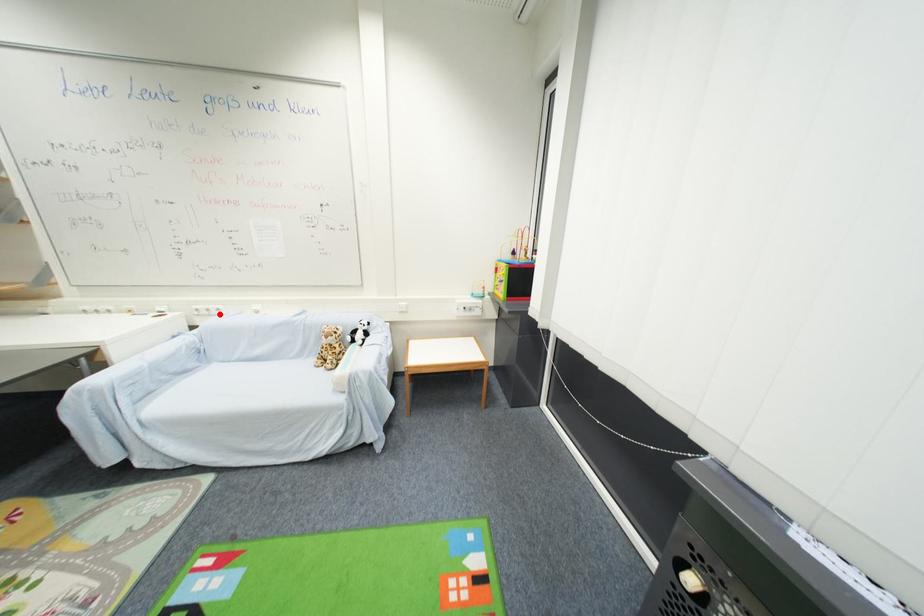
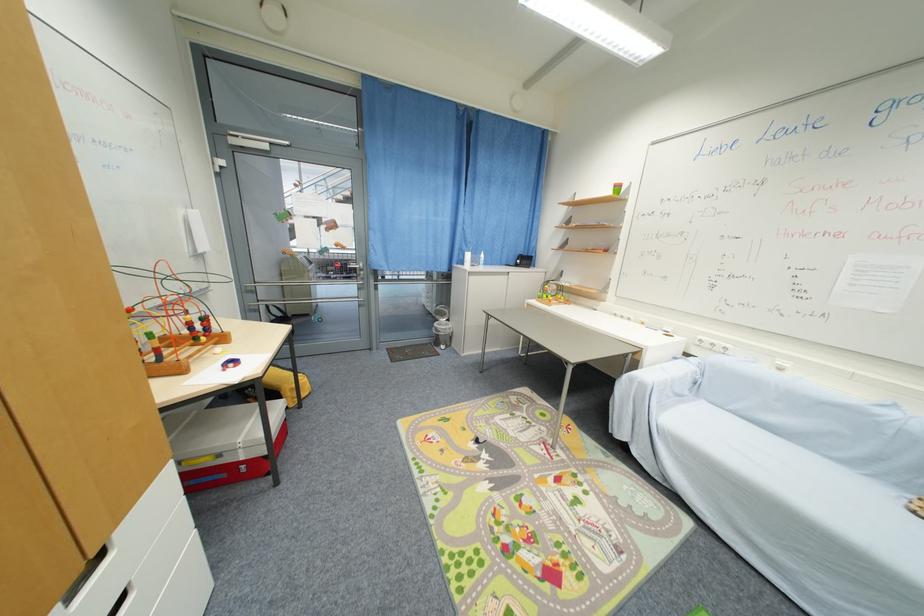
The point at the highlighted location is marked in the first image. Where is the corresponding point in the second image?

(723, 351)